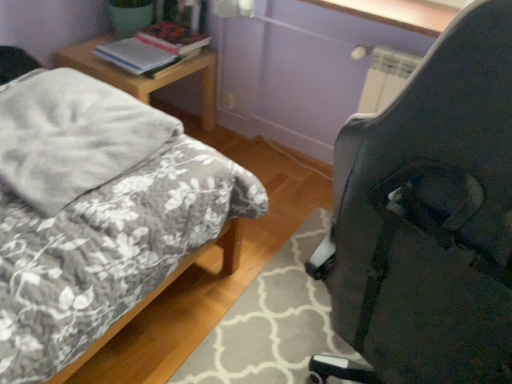
Question: Is gray soft blanket at left inside or outside of woodennightstand at left?

Choices:
 (A) inside
 (B) outside

Answer: (B)

Question: From the image's perspective, is gray soft blanket at left positioned above or below woodennightstand at left?

Choices:
 (A) below
 (B) above

Answer: (A)

Question: Which of these objects is positioned closest to the woodennightstand at left?

Choices:
 (A) floral-patterned fabric bed at left
 (B) hardcover book at upper left, which appears as the second book when viewed from the front
 (C) white glossy window sill at upper center
 (D) black plastic chair at right
 (E) gray soft blanket at left

Answer: (B)

Question: Which is farther from the white glossy window sill at upper center?

Choices:
 (A) woodennightstand at left
 (B) white paper stack at upper left, arranged as the second book when viewed from the back
 (C) gray soft blanket at left
 (D) black plastic chair at right
 (E) hardcover book at upper left, which appears as the second book when viewed from the front

Answer: (D)